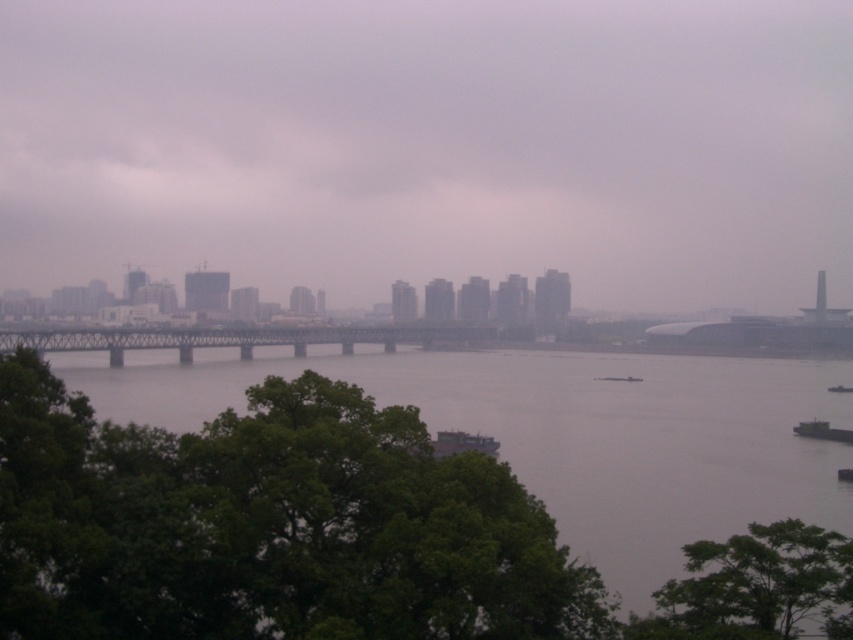
Is gray concrete bridge at center below metallic gray boat at center?

Yes.

Between gray concrete bridge at center and metallic gray boat at center, which one appears on the right side from the viewer's perspective?

From the viewer's perspective, metallic gray boat at center appears more on the right side.

Which is behind, point (373, 632) or point (479, 440)?

The point (479, 440) is more distant.

In order to click on gray concrete bridge at center in this screenshot , I will do `click(325, 532)`.

Is point (310, 97) farther from viewer compared to point (207, 577)?

Yes, it is behind point (207, 577).

Consider the image. Is matte gray bridge at center thinner than gray concrete bridge at center?

Incorrect, matte gray bridge at center's width is not less than gray concrete bridge at center's.

Is point (666, 202) positioned behind point (409, 548)?

Yes.

Identify the location of matte gray bridge at center. (432, 145).

Does matte gray bridge at center have a greater height compared to green leafy tree at lower right?

Yes.

Is the position of matte gray bridge at center less distant than that of green leafy tree at lower right?

No.

Who is more forward, (x=724, y=145) or (x=685, y=554)?

Point (x=685, y=554) is in front.

What are the coordinates of `matte gray bridge at center` in the screenshot? It's located at (432, 145).